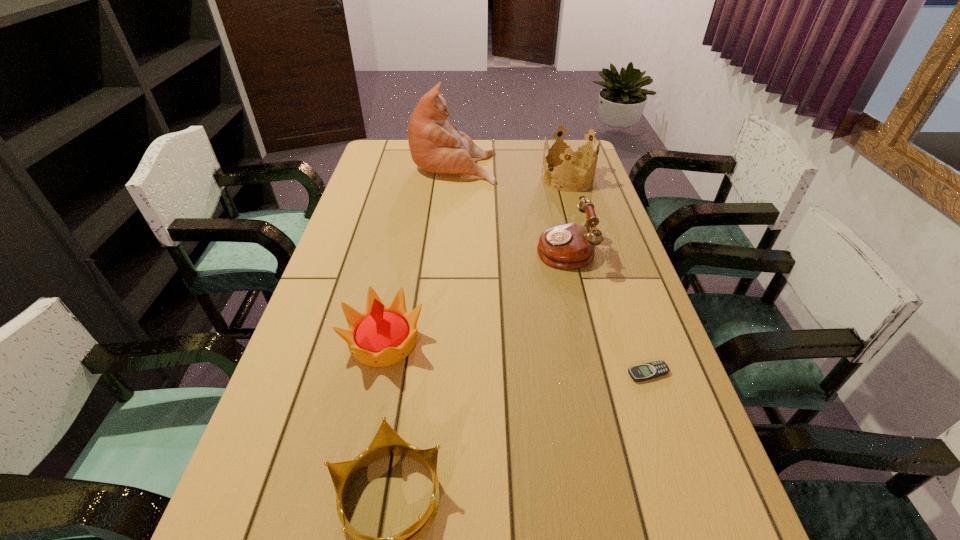
You are a GUI agent. You are given a task and a screenshot of the screen. Output one action in this format:
    pyautogui.click(x=<x>, y=<y>)
    Task: Click on the vacant space that satisfies the following two spatial constraints: 1. on the front side of the rightmost crown; 2. on the dial of the fourth nearest object
    The height and width of the screenshot is (540, 960).
    Given the screenshot: What is the action you would take?
    pyautogui.click(x=588, y=248)

Where is `vacant region that satisfies the following two spatial constraints: 1. on the front side of the shortest object; 2. on the right side of the second farthest crown`? Image resolution: width=960 pixels, height=540 pixels. vacant region that satisfies the following two spatial constraints: 1. on the front side of the shortest object; 2. on the right side of the second farthest crown is located at coordinates (377, 373).

Identify the location of free space that satisfies the following two spatial constraints: 1. on the dial of the third farthest object; 2. on the right side of the beeper. The image size is (960, 540). (592, 373).